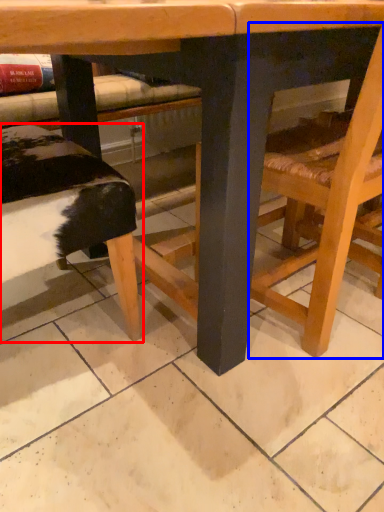
Question: Which point is further to the camera, park bench (highlighted by a red box) or chair (highlighted by a blue box)?

Choices:
 (A) park bench
 (B) chair

Answer: (A)